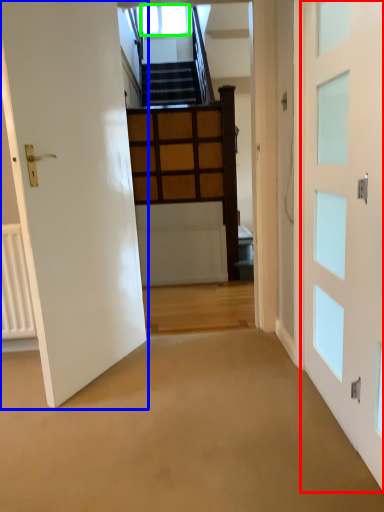
Question: Which object is the closest to the door (highlighted by a red box)? Choose among these: door (highlighted by a blue box) or window (highlighted by a green box).

Choices:
 (A) door
 (B) window

Answer: (A)